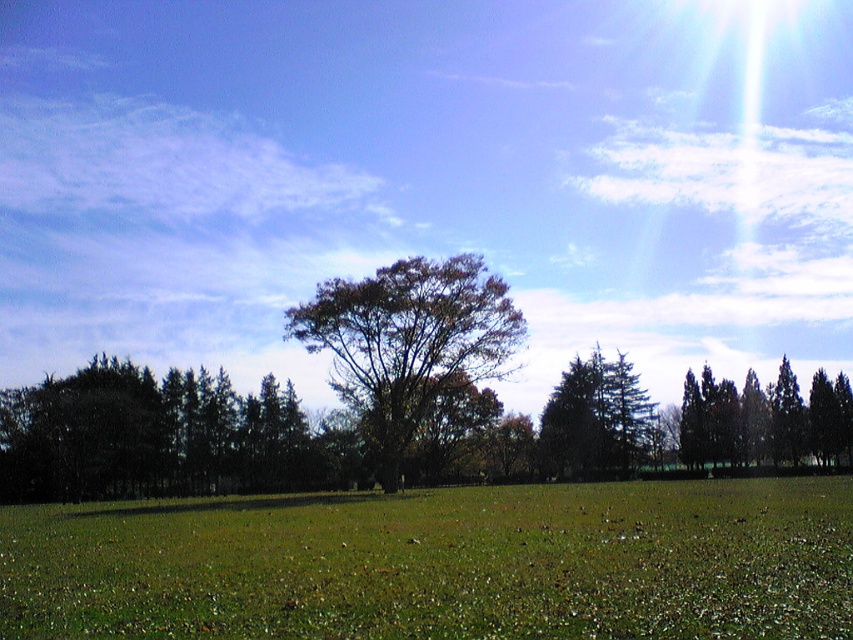
In the scene shown: Which is more to the right, green grassy field at center or dark green leafy tree at left?

green grassy field at center is more to the right.

Can you confirm if green grassy field at center is bigger than dark green leafy tree at left?

Correct, green grassy field at center is larger in size than dark green leafy tree at left.

Does point (692, 560) come behind point (241, 468)?

No, it is in front of (241, 468).

Where is `green grassy field at center`? The height and width of the screenshot is (640, 853). green grassy field at center is located at coordinates (440, 563).

Is green leafy tree at center positioned in front of green glossy trees at right?

Yes.

Which of these two, green leafy tree at center or green glossy trees at right, stands shorter?

With less height is green glossy trees at right.

Does point (494, 301) come in front of point (741, 428)?

Yes.

Find the location of a particular element. Image resolution: width=853 pixels, height=640 pixels. green leafy tree at center is located at coordinates (409, 342).

Measure the distance between dark green leafy tree at left and camera.

dark green leafy tree at left is 241.99 feet from camera.

Between dark green leafy tree at left and green leafy tree at center, which one appears on the left side from the viewer's perspective?

dark green leafy tree at left

Describe the element at coordinates (149, 436) in the screenshot. I see `dark green leafy tree at left` at that location.

Find the location of a particular element. The height and width of the screenshot is (640, 853). dark green leafy tree at left is located at coordinates (149, 436).